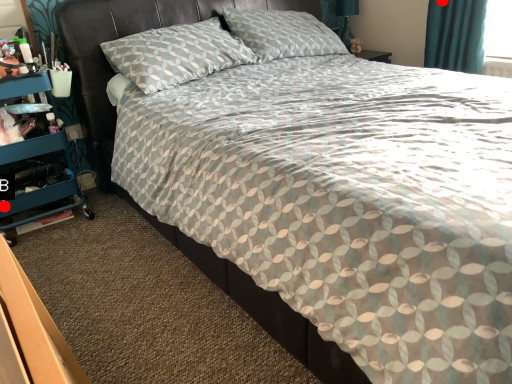
Question: Two points are circled on the image, labeled by A and B beside each circle. Among these points, which one is nearest to the camera?

Choices:
 (A) A is closer
 (B) B is closer

Answer: (B)